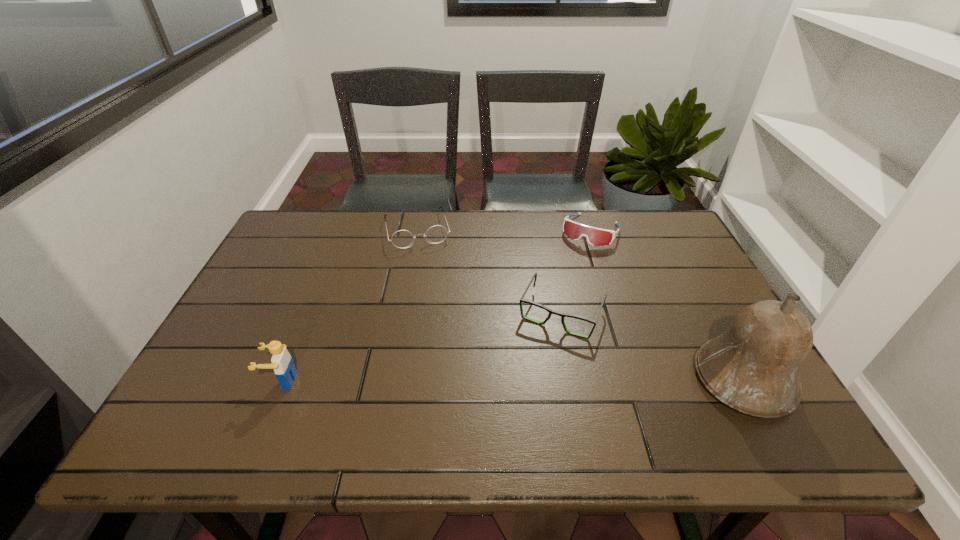
This screenshot has width=960, height=540. Find the location of `vacant area situated 0.070m on the face of the Lego`. vacant area situated 0.070m on the face of the Lego is located at coordinates (235, 381).

The height and width of the screenshot is (540, 960). Find the location of `free space located on the face of the Lego`. free space located on the face of the Lego is located at coordinates (217, 381).

The image size is (960, 540). Find the location of `vacant space positioned on the left of the tallest object`. vacant space positioned on the left of the tallest object is located at coordinates point(588,380).

The image size is (960, 540). I want to click on blank space located 0.150m on the lens of the right spectacles, so click(526, 386).

The width and height of the screenshot is (960, 540). Identify the location of vacant region located 0.080m on the lens of the right spectacles. (537, 363).

Locate an element on the screen. This screenshot has width=960, height=540. free region located on the lens of the right spectacles is located at coordinates click(540, 354).

Locate an element on the screen. This screenshot has width=960, height=540. free space located on the front-facing side of the goggles is located at coordinates (552, 301).

The width and height of the screenshot is (960, 540). In order to click on vacant space located 0.050m on the front-facing side of the goggles in this screenshot , I will do `click(577, 256)`.

Find the location of `vacant space situated on the front-facing side of the goggles`. vacant space situated on the front-facing side of the goggles is located at coordinates (556, 294).

What are the coordinates of `blank space located 0.320m on the front-facing side of the farther spectacles` in the screenshot? It's located at (441, 325).